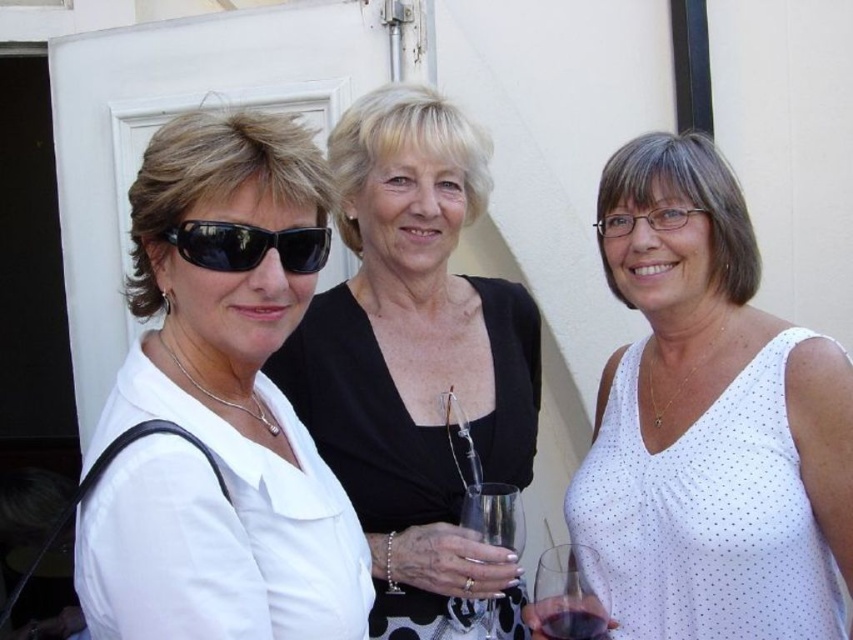
Between white dotted tank top at center and clear glass wine glass at center, which one is positioned lower?

clear glass wine glass at center is lower down.

Can you confirm if white dotted tank top at center is positioned below clear glass wine glass at center?

No.

The height and width of the screenshot is (640, 853). What are the coordinates of `white dotted tank top at center` in the screenshot? It's located at (711, 420).

Between point (187, 250) and point (602, 625), which one is positioned behind?

Point (602, 625)

Who is taller, black plastic sunglasses at left or transparent glass wine glass at lower right?

With more height is transparent glass wine glass at lower right.

Identify the location of black plastic sunglasses at left. (248, 244).

Does black plastic sunglasses at left appear under translucent glass at center?

Incorrect, black plastic sunglasses at left is not positioned below translucent glass at center.

Is point (283, 252) less distant than point (604, 636)?

Yes, it is.

Describe the element at coordinates (248, 244) in the screenshot. I see `black plastic sunglasses at left` at that location.

The width and height of the screenshot is (853, 640). What are the coordinates of `black plastic sunglasses at left` in the screenshot? It's located at (248, 244).